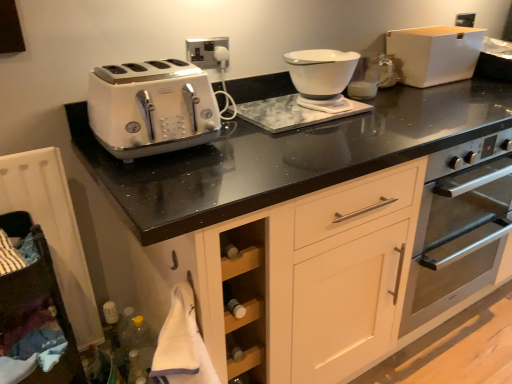
Question: Is white glossy bowl at center facing away from white glossy bowl at upper center?

Choices:
 (A) yes
 (B) no

Answer: (B)

Question: From the image's perspective, does white glossy bowl at center appear higher than white glossy bowl at upper center?

Choices:
 (A) yes
 (B) no

Answer: (B)

Question: Is white glossy bowl at center located outside white glossy bowl at upper center?

Choices:
 (A) no
 (B) yes

Answer: (B)

Question: From a real-world perspective, is white glossy bowl at center positioned under white glossy bowl at upper center based on gravity?

Choices:
 (A) no
 (B) yes

Answer: (A)

Question: Are white glossy bowl at center and white glossy bowl at upper center located far from each other?

Choices:
 (A) no
 (B) yes

Answer: (A)

Question: Visually, is white glossy bowl at center positioned to the left or to the right of white matte storage box at upper right?

Choices:
 (A) right
 (B) left

Answer: (B)

Question: Relative to white matte storage box at upper right, is white glossy bowl at center in front or behind?

Choices:
 (A) front
 (B) behind

Answer: (A)

Question: Which is correct: white glossy bowl at center is inside white matte storage box at upper right, or outside of it?

Choices:
 (A) inside
 (B) outside

Answer: (B)

Question: From the image's perspective, relative to white matte storage box at upper right, is white glossy bowl at center above or below?

Choices:
 (A) above
 (B) below

Answer: (B)

Question: From a real-world perspective, is white wood cabinet at lower left above or below white matte storage box at upper right?

Choices:
 (A) below
 (B) above

Answer: (A)

Question: Considering the positions of white wood cabinet at lower left and white matte storage box at upper right in the image, is white wood cabinet at lower left wider or thinner than white matte storage box at upper right?

Choices:
 (A) wide
 (B) thin

Answer: (A)

Question: Looking at the image, does white wood cabinet at lower left seem bigger or smaller compared to white matte storage box at upper right?

Choices:
 (A) big
 (B) small

Answer: (A)

Question: From the image's perspective, is white wood cabinet at lower left positioned above or below white matte storage box at upper right?

Choices:
 (A) above
 (B) below

Answer: (B)

Question: Is white glossy bowl at upper center taller or shorter than white glossy bowl at center?

Choices:
 (A) tall
 (B) short

Answer: (A)

Question: Do you think white glossy bowl at upper center is within white glossy bowl at center, or outside of it?

Choices:
 (A) inside
 (B) outside

Answer: (B)